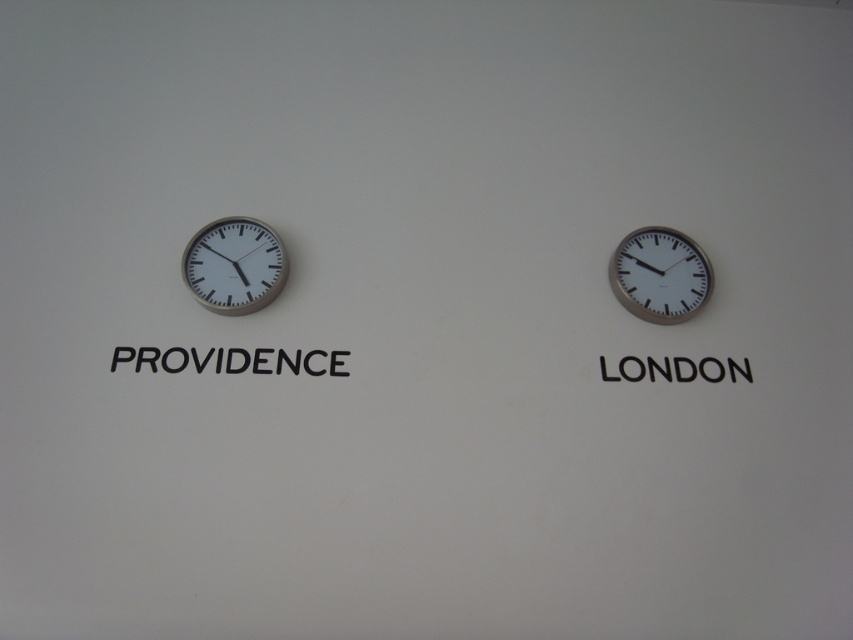
Question: From the image, what is the correct spatial relationship of silver metallic clock at left in relation to black matte providence at left?

Choices:
 (A) above
 (B) below

Answer: (A)

Question: Which point is farther to the camera?

Choices:
 (A) blackmaterial/texturelondon at right
 (B) black matte providence at left
 (C) silver metallic clock at left

Answer: (A)

Question: Is silver metallic clock at left wider than black matte providence at left?

Choices:
 (A) no
 (B) yes

Answer: (A)

Question: Based on their relative distances, which object is nearer to the white metallic clock at right?

Choices:
 (A) blackmaterial/texturelondon at right
 (B) silver metallic clock at left
 (C) black matte providence at left

Answer: (A)

Question: In this image, where is black matte providence at left located relative to blackmaterial/texturelondon at right?

Choices:
 (A) above
 (B) below

Answer: (A)

Question: Estimate the real-world distances between objects in this image. Which object is farther from the white metallic clock at right?

Choices:
 (A) blackmaterial/texturelondon at right
 (B) black matte providence at left

Answer: (B)